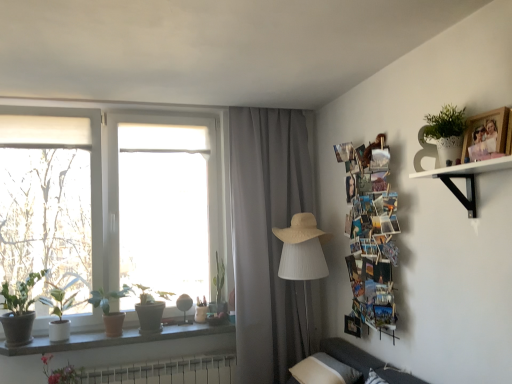
Question: Should I look upward or downward to see granite window sill at lower left?

Choices:
 (A) up
 (B) down

Answer: (B)

Question: Is gray fabric curtain at center closer to the viewer compared to pink matte flower at lower left?

Choices:
 (A) no
 (B) yes

Answer: (A)

Question: Does gray fabric curtain at center turn towards pink matte flower at lower left?

Choices:
 (A) no
 (B) yes

Answer: (A)

Question: Is the surface of gray fabric curtain at center in direct contact with pink matte flower at lower left?

Choices:
 (A) yes
 (B) no

Answer: (B)

Question: Considering the relative sizes of gray fabric curtain at center and pink matte flower at lower left in the image provided, is gray fabric curtain at center shorter than pink matte flower at lower left?

Choices:
 (A) yes
 (B) no

Answer: (B)

Question: Is gray fabric curtain at center thinner than pink matte flower at lower left?

Choices:
 (A) no
 (B) yes

Answer: (B)

Question: Is gray fabric curtain at center far away from pink matte flower at lower left?

Choices:
 (A) no
 (B) yes

Answer: (B)

Question: Are beige straw hat at center and white plastic radiator at lower center making contact?

Choices:
 (A) yes
 (B) no

Answer: (B)

Question: Is beige straw hat at center outside of white plastic radiator at lower center?

Choices:
 (A) no
 (B) yes

Answer: (B)

Question: From the image's perspective, is beige straw hat at center under white plastic radiator at lower center?

Choices:
 (A) no
 (B) yes

Answer: (A)

Question: Does beige straw hat at center contain white plastic radiator at lower center?

Choices:
 (A) no
 (B) yes

Answer: (A)

Question: Can you confirm if beige straw hat at center is smaller than white plastic radiator at lower center?

Choices:
 (A) yes
 (B) no

Answer: (A)

Question: Are beige straw hat at center and white plastic radiator at lower center located far from each other?

Choices:
 (A) no
 (B) yes

Answer: (B)

Question: Are gray fabric curtain at center and granite window sill at lower left making contact?

Choices:
 (A) yes
 (B) no

Answer: (B)